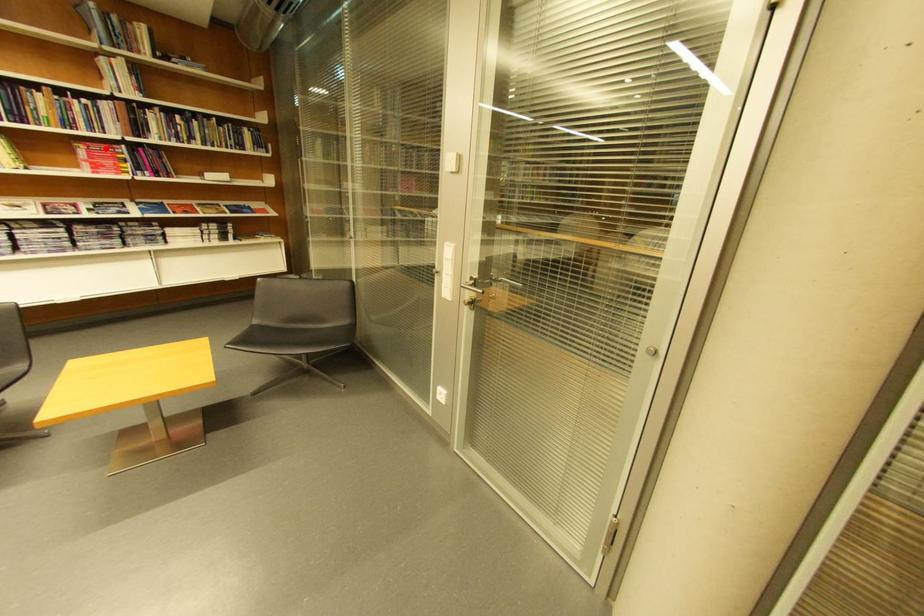
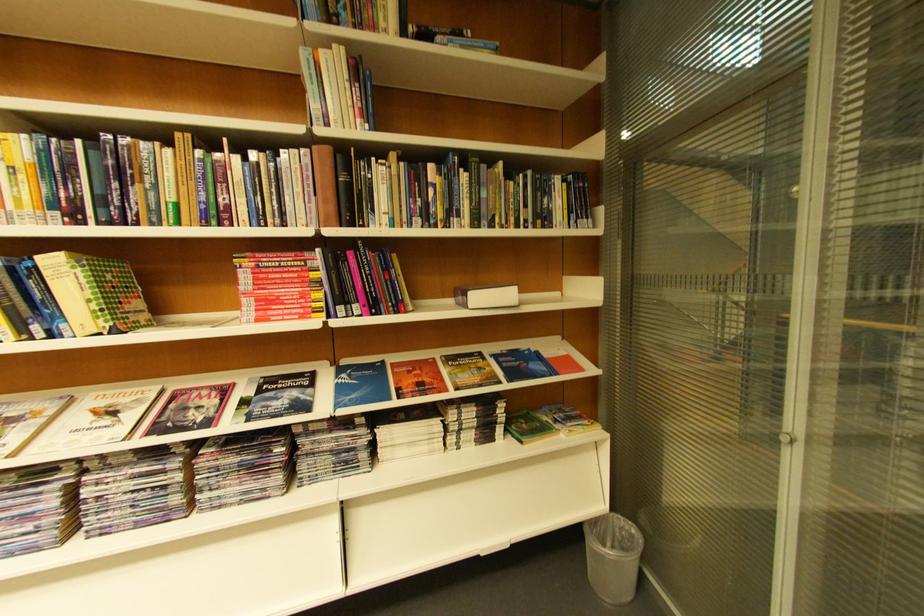
Locate, in the second image, the point that corresponds to the highlighted location in the first image.

(281, 262)